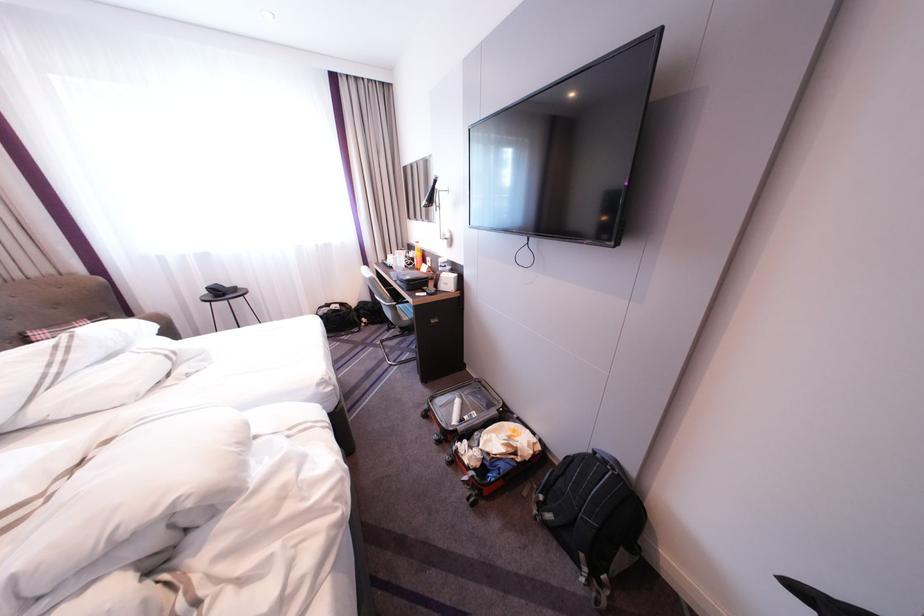
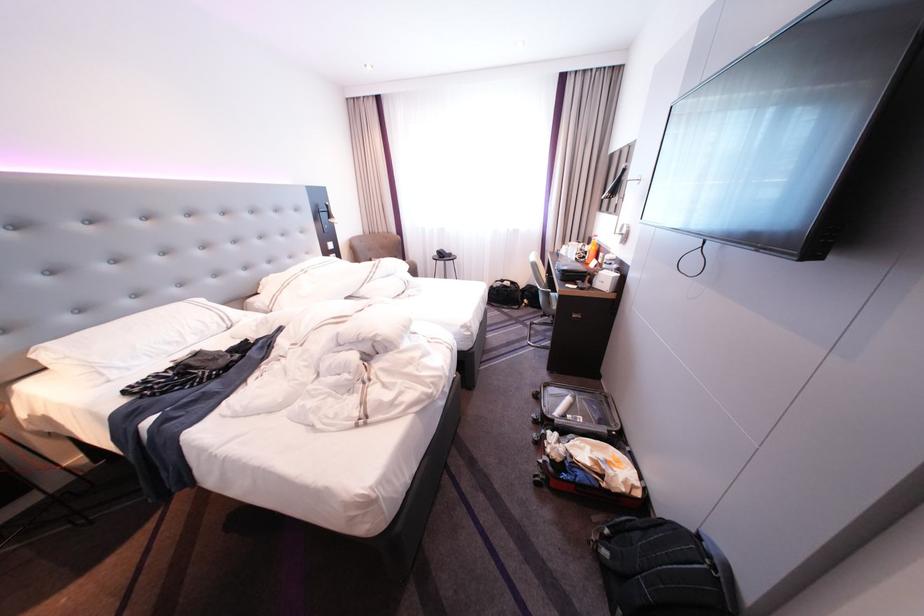
Locate, in the second image, the point that corresponds to point (621, 468) in the first image.

(720, 562)